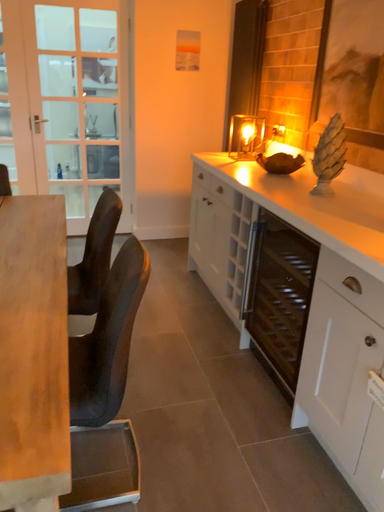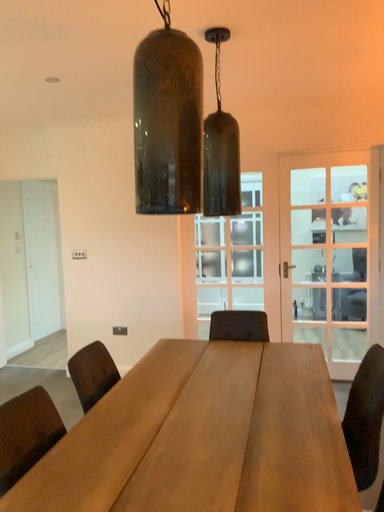
Question: Which way did the camera rotate in the video?

Choices:
 (A) rotated upward
 (B) rotated downward

Answer: (A)